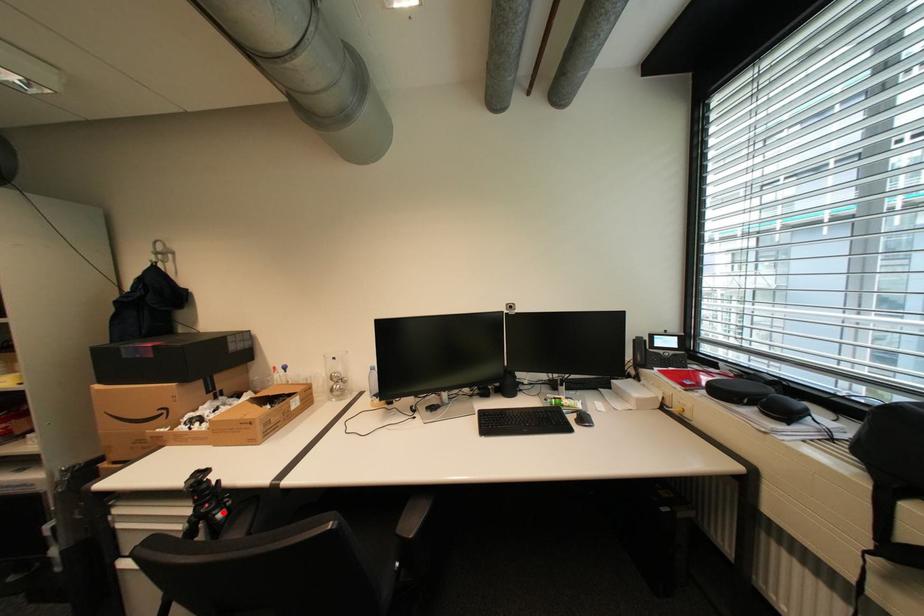
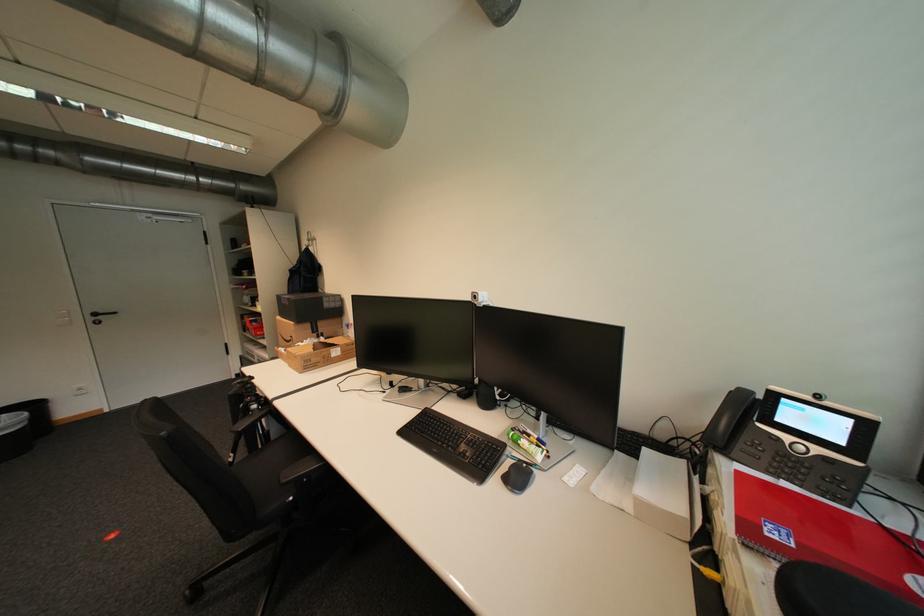
Locate, in the second image, the point that corresponds to the highlighted location in the first image.

(261, 403)